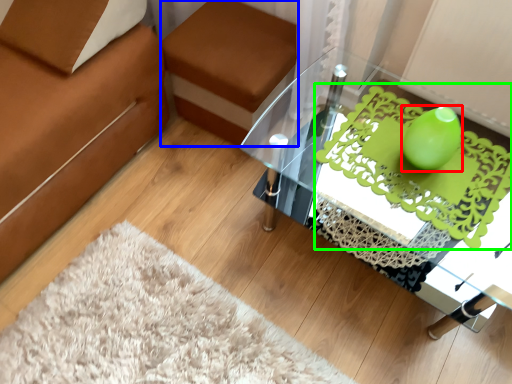
Question: Which object is positioned closest to teal (highlighted by a red box)? Select from footrest (highlighted by a blue box) and design (highlighted by a green box).

Choices:
 (A) footrest
 (B) design

Answer: (B)